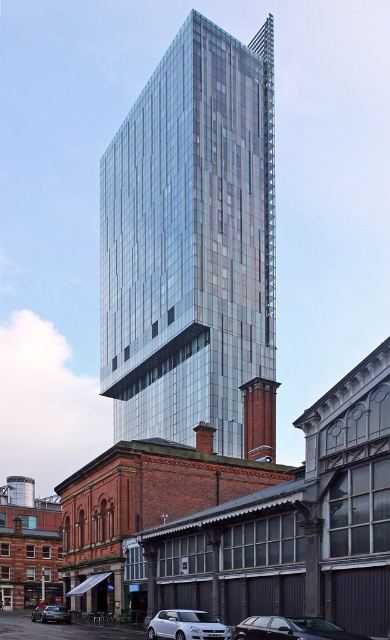
Can you confirm if metallic silver car at lower center is taller than white matte suv at lower center?

No, metallic silver car at lower center is not taller than white matte suv at lower center.

Is metallic silver car at lower center closer to camera compared to white matte suv at lower center?

Yes, it is.

Where is `metallic silver car at lower center`? This screenshot has width=390, height=640. metallic silver car at lower center is located at coordinates (290, 628).

In order to click on metallic silver car at lower center in this screenshot , I will do `click(290, 628)`.

You are a GUI agent. You are given a task and a screenshot of the screen. Output one action in this format:
    pyautogui.click(x=<x>, y=<y>)
    Task: Click on the glassy metallic skyscraper at center
    
    Given the screenshot: What is the action you would take?
    pyautogui.click(x=191, y=240)

Is glassy metallic skyscraper at center to the right of metallic silver car at lower center from the viewer's perspective?

Incorrect, glassy metallic skyscraper at center is not on the right side of metallic silver car at lower center.

Consider the image. Who is more forward, [246,81] or [306,627]?

Point [306,627] is more forward.

At what (x,y) coordinates should I click in order to perform the action: click on glassy metallic skyscraper at center. Please return your answer as a coordinate pair (x, y). Looking at the image, I should click on (191, 240).

Can you confirm if glassy metallic skyscraper at center is positioned to the right of matte black car at lower left?

Yes, glassy metallic skyscraper at center is to the right of matte black car at lower left.

Identify the location of glassy metallic skyscraper at center. (191, 240).